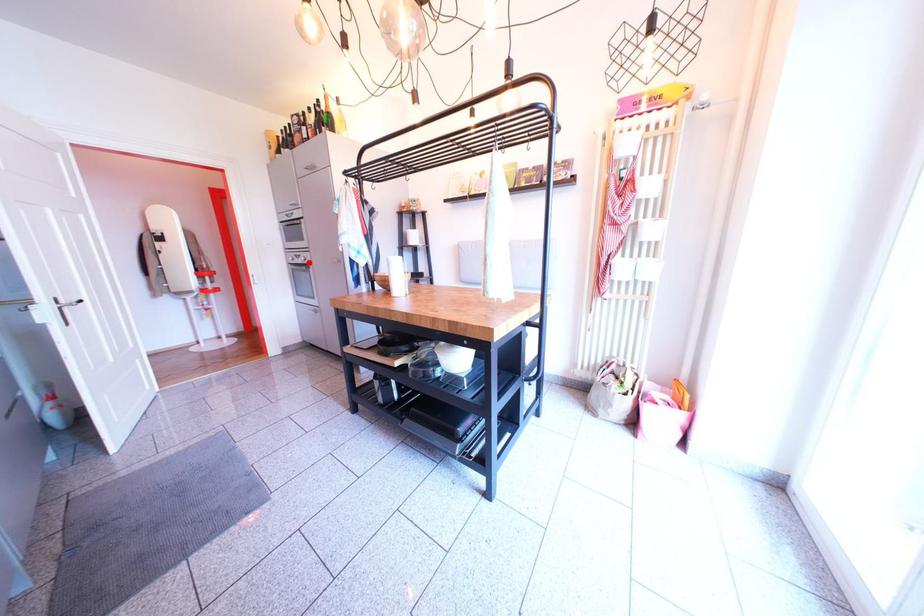
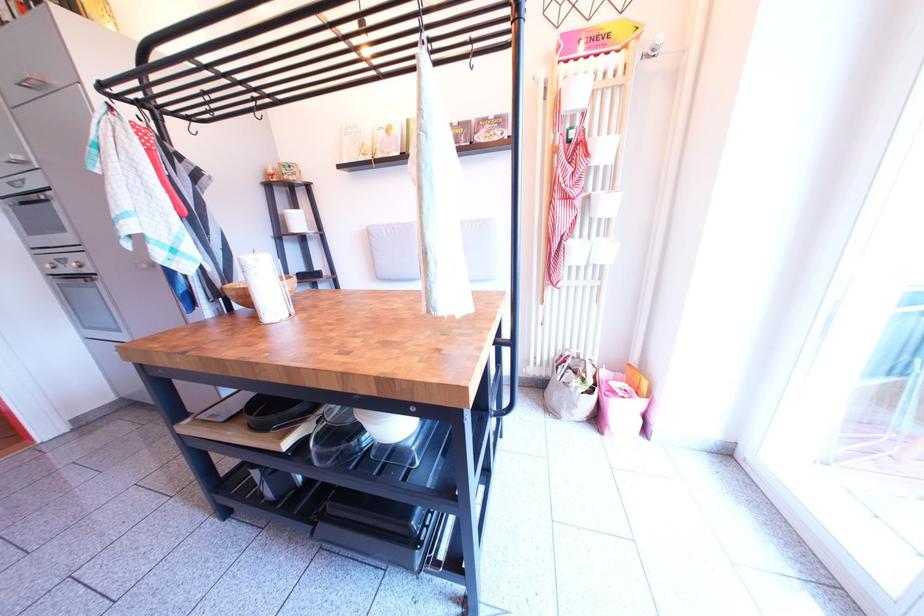
Find the pixel in the second image that matches the highlighted location in the first image.

(74, 267)